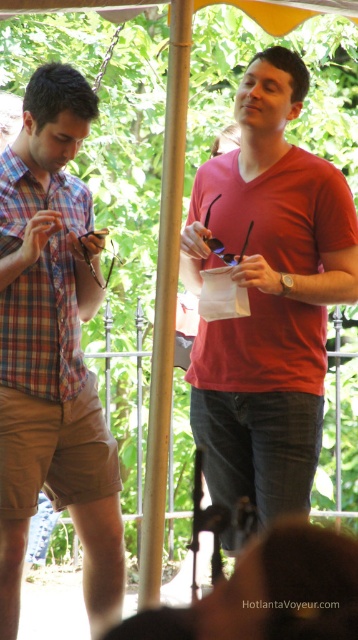
Question: Which point is closer to the camera?

Choices:
 (A) (98, 604)
 (B) (17, 304)
 (C) (234, 355)

Answer: (B)

Question: Does plaid cotton shorts at left appear on the left side of plaid cotton shirt at left?

Choices:
 (A) yes
 (B) no

Answer: (B)

Question: Can you confirm if matte red shirt at center is positioned below plaid cotton shorts at left?

Choices:
 (A) yes
 (B) no

Answer: (B)

Question: Which object is farther from the camera taking this photo?

Choices:
 (A) plaid cotton shorts at left
 (B) matte red shirt at center

Answer: (A)

Question: Among these points, which one is nearest to the camera?

Choices:
 (A) (74, 193)
 (B) (41, 394)

Answer: (B)

Question: Is plaid cotton shorts at left to the right of plaid cotton shirt at left from the viewer's perspective?

Choices:
 (A) no
 (B) yes

Answer: (B)